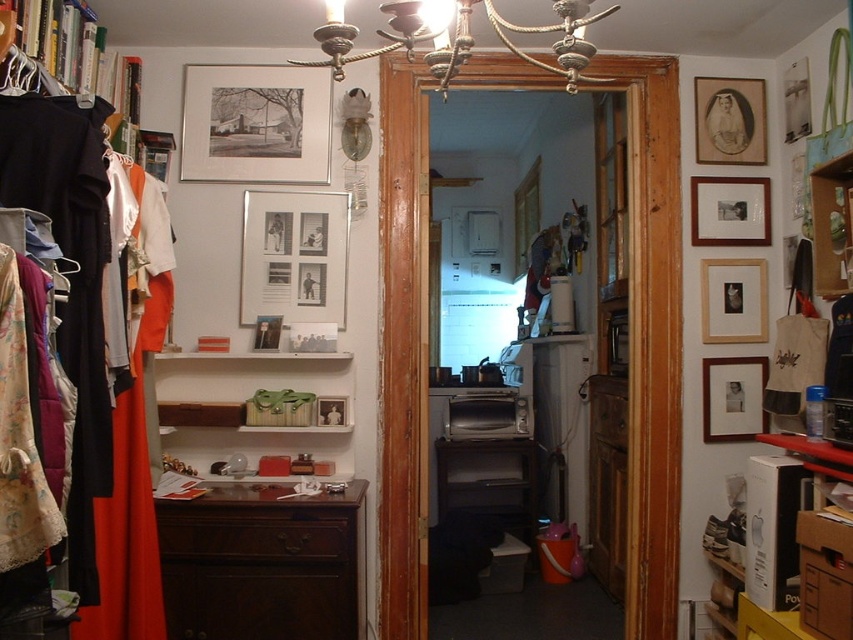
You are standing in the hallway and want to take a photo of two points marked in the image. The first point is at coordinate point (763, 106) and the second is at coordinate point (724, 184). Which point is closer to the camera?

Point (763, 106) is further to the camera than point (724, 184), so the second point is closer to the camera.

You are standing in the hallway and see two points marked in the image. Which point is closer to you, point (300, 131) or point (433, 52)?

Point (433, 52) is closer to you because point (300, 131) is behind it.

You are organizing items in the space and need to place a new item between the matte black clothes at left and the matte silver picture frame at upper center. Is there enough vertical space between them to fit a 10 cm tall item?

The matte black clothes at left is positioned under the matte silver picture frame at upper center, so there is vertical space between them. Since the item is only 10 cm tall, it should fit between them.